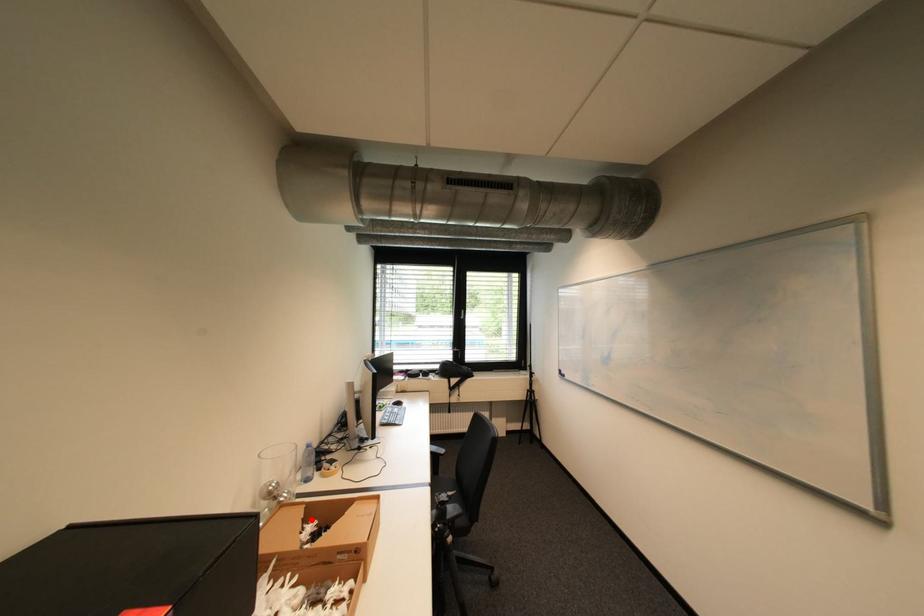
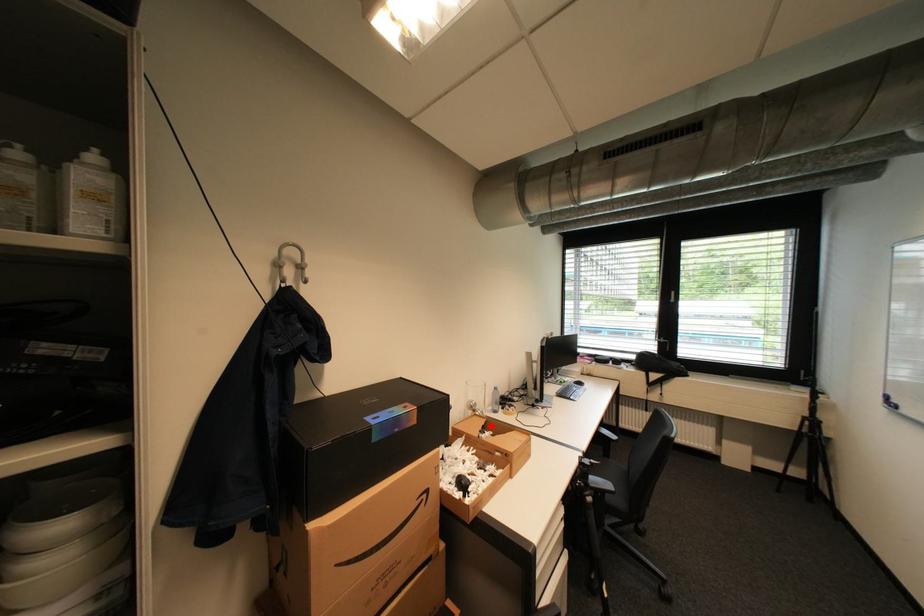
I am providing you with two images of the same scene from different viewpoints. A red point is marked on the first image and another point is marked on the second image. Is the marked point in image1 the same physical position as the marked point in image2?

Yes